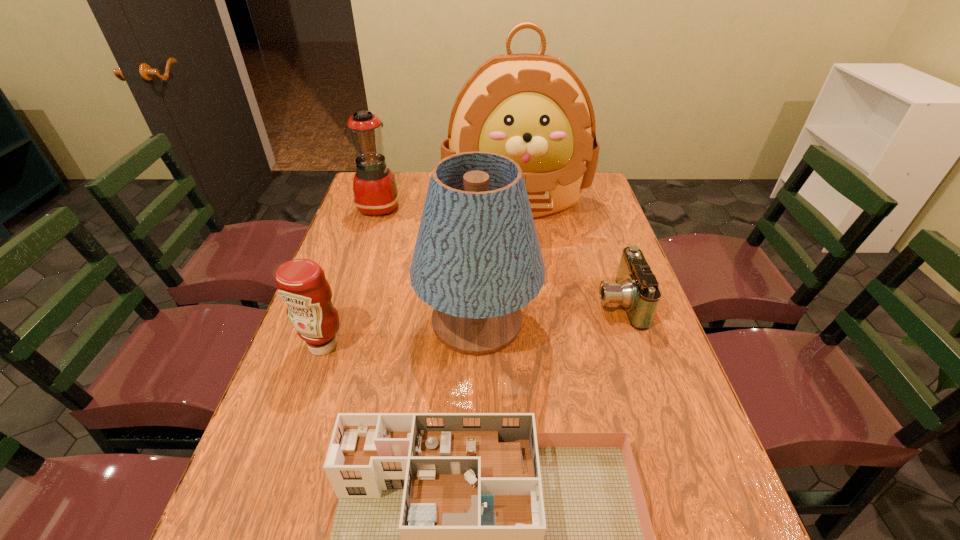
This screenshot has width=960, height=540. Identify the location of the tallest object. (533, 108).

Where is `lampshade`? lampshade is located at coordinates (477, 261).

I want to click on the third tallest object, so click(375, 191).

This screenshot has width=960, height=540. I want to click on condiment, so click(x=301, y=283).

This screenshot has height=540, width=960. Find the location of `camcorder`. camcorder is located at coordinates pyautogui.click(x=636, y=289).

Where is `vacant space located on the front-facing side of the backpack`? This screenshot has width=960, height=540. vacant space located on the front-facing side of the backpack is located at coordinates (530, 312).

Image resolution: width=960 pixels, height=540 pixels. Identify the location of vacant space situated on the front of the fifth shortest object. (477, 517).

You are a GUI agent. You are given a task and a screenshot of the screen. Output one action in this format:
    pyautogui.click(x=<x>, y=<y>)
    Task: Click on the free location located on the controls of the fourth shortest object
    
    Given the screenshot: What is the action you would take?
    pyautogui.click(x=470, y=206)

Where is `free space located 0.070m on the right of the condiment`? This screenshot has width=960, height=540. free space located 0.070m on the right of the condiment is located at coordinates (376, 345).

Where is `vacant space situated on the front-facing side of the camcorder`? This screenshot has width=960, height=540. vacant space situated on the front-facing side of the camcorder is located at coordinates (566, 302).